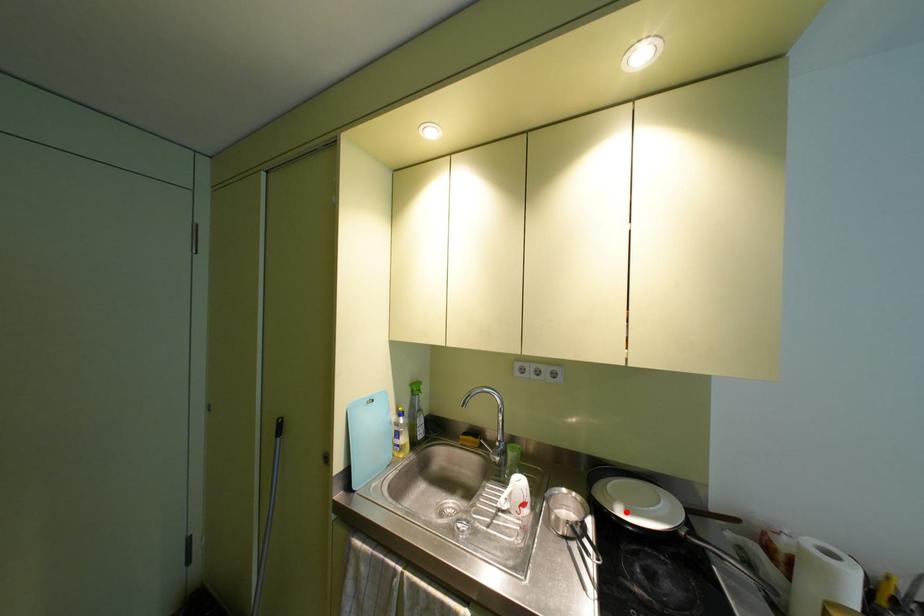
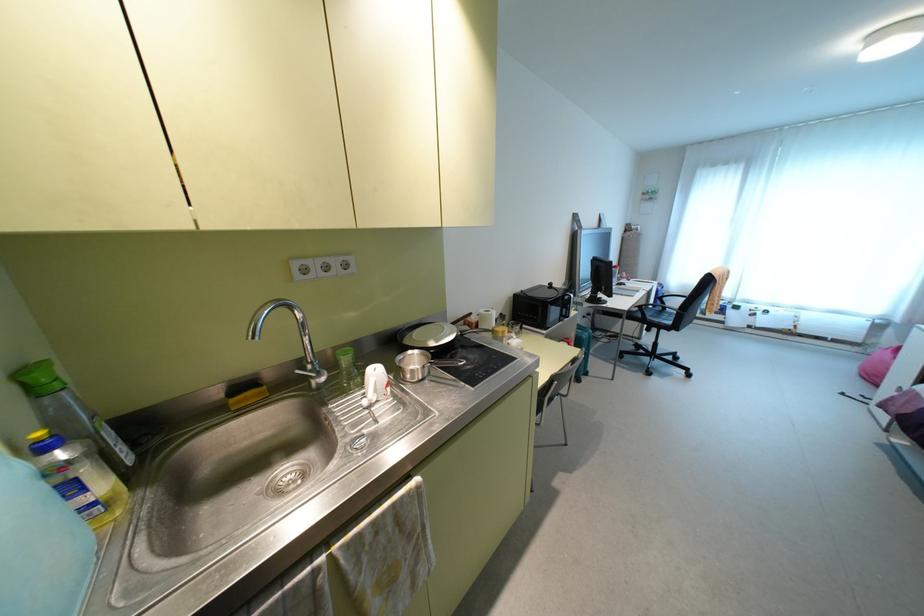
The point at the highlighted location is marked in the first image. Where is the corresponding point in the second image?

(435, 341)